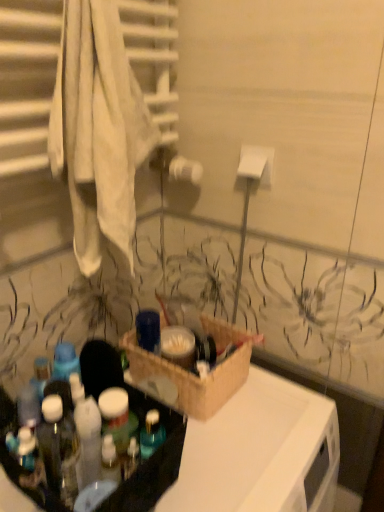
Identify the location of translucent plastic bottles at lower left. (59, 449).

The width and height of the screenshot is (384, 512). Describe the element at coordinates (59, 449) in the screenshot. I see `translucent plastic bottles at lower left` at that location.

What do you see at coordinates (192, 373) in the screenshot?
I see `woven basket at center` at bounding box center [192, 373].

Find the location of a particular element. This screenshot has height=512, width=384. woven basket at center is located at coordinates (192, 373).

Identify the location of translucent plastic bottles at lower left. This screenshot has height=512, width=384. (59, 449).

Between woven basket at center and translucent plastic bottles at lower left, which one appears on the right side from the viewer's perspective?

From the viewer's perspective, woven basket at center appears more on the right side.

Considering their positions, is woven basket at center located in front of or behind translucent plastic bottles at lower left?

In the image, woven basket at center appears behind translucent plastic bottles at lower left.

Consider the image. Which is closer, (150, 388) or (53, 423)?

Positioned in front is point (53, 423).

Looking at this image, from the image's perspective, is woven basket at center under translucent plastic bottles at lower left?

Actually, woven basket at center appears above translucent plastic bottles at lower left in the image.

From a real-world perspective, which object rests below the other?

In real-world perspective, woven basket at center is lower.

Considering the sizes of objects woven basket at center and translucent plastic bottles at lower left in the image provided, who is thinner, woven basket at center or translucent plastic bottles at lower left?

With smaller width is translucent plastic bottles at lower left.

Between woven basket at center and translucent plastic bottles at lower left, which one has more height?

Standing taller between the two is translucent plastic bottles at lower left.

Is woven basket at center smaller than translucent plastic bottles at lower left?

No.

Is woven basket at center completely or partially outside of translucent plastic bottles at lower left?

woven basket at center lies outside translucent plastic bottles at lower left's area.

Would you consider woven basket at center to be distant from translucent plastic bottles at lower left?

woven basket at center is near translucent plastic bottles at lower left, not far away.

Is woven basket at center facing towards translucent plastic bottles at lower left?

No, woven basket at center is not oriented towards translucent plastic bottles at lower left.

How different are the orientations of woven basket at center and translucent plastic bottles at lower left in degrees?

They differ by 0.00246 degrees in their facing directions.

Where is `bottle below the woven basket at center (from the image's perspective)`? Image resolution: width=384 pixels, height=512 pixels. bottle below the woven basket at center (from the image's perspective) is located at coordinates (59, 449).

Is translucent plastic bottles at lower left at the right side of woven basket at center?

In fact, translucent plastic bottles at lower left is to the left of woven basket at center.

Is translucent plastic bottles at lower left further to the viewer compared to woven basket at center?

→ That is False.

Does point (69, 468) lie behind point (129, 361)?

No, it is not.

From the image's perspective, which one is positioned higher, translucent plastic bottles at lower left or woven basket at center?

woven basket at center is shown above in the image.

From a real-world perspective, is translucent plastic bottles at lower left beneath woven basket at center?

Actually, translucent plastic bottles at lower left is physically above woven basket at center in the real world.

Which of these two, translucent plastic bottles at lower left or woven basket at center, is wider?

Wider between the two is woven basket at center.

Considering the relative sizes of translucent plastic bottles at lower left and woven basket at center in the image provided, is translucent plastic bottles at lower left taller than woven basket at center?

Correct, translucent plastic bottles at lower left is much taller as woven basket at center.

Considering the relative sizes of translucent plastic bottles at lower left and woven basket at center in the image provided, is translucent plastic bottles at lower left bigger than woven basket at center?

Actually, translucent plastic bottles at lower left might be smaller than woven basket at center.

Is translucent plastic bottles at lower left inside the boundaries of woven basket at center, or outside?

translucent plastic bottles at lower left cannot be found inside woven basket at center.

Is translucent plastic bottles at lower left touching woven basket at center?

translucent plastic bottles at lower left and woven basket at center are not in contact.

Is translucent plastic bottles at lower left oriented towards woven basket at center?

No, translucent plastic bottles at lower left is not oriented towards woven basket at center.

Can you tell me how much translucent plastic bottles at lower left and woven basket at center differ in facing direction?

0.00246 degrees.

Locate an element on the screen. This screenshot has width=384, height=512. bottle to the left of woven basket at center is located at coordinates (x=59, y=449).

I want to click on bottle that is on the left side of woven basket at center, so click(x=59, y=449).

This screenshot has height=512, width=384. In order to click on bottle in front of the woven basket at center in this screenshot , I will do `click(59, 449)`.